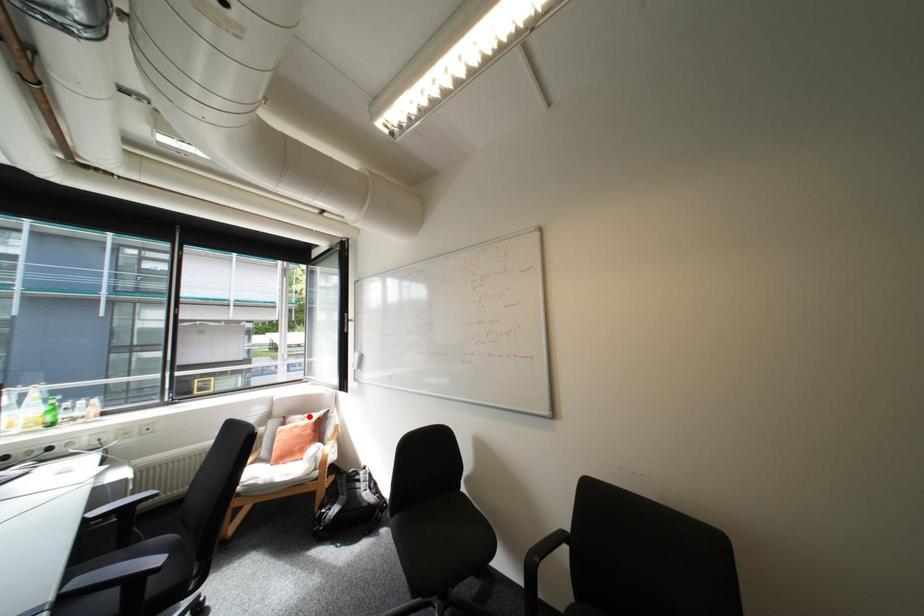
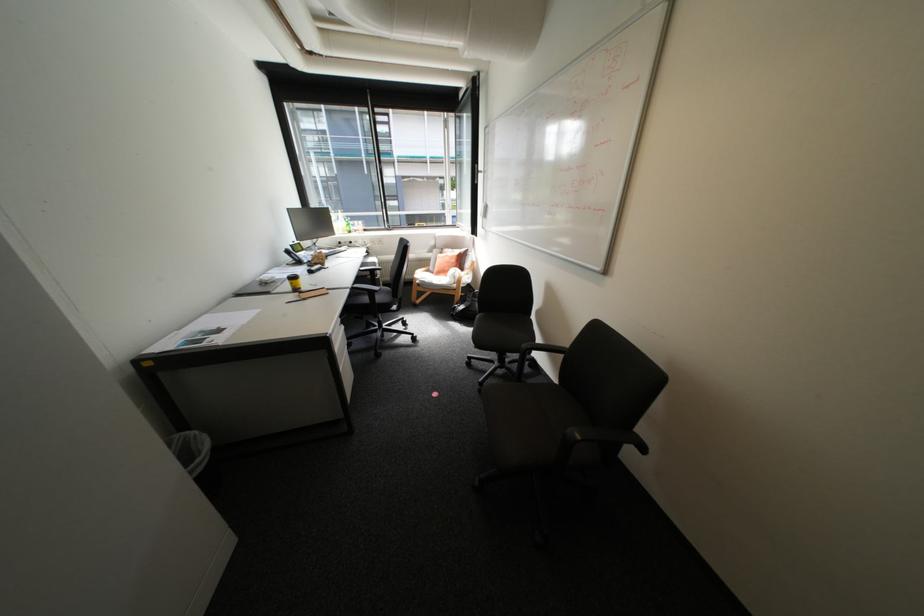
Question: I am providing you with two images of the same scene from different viewpoints. Given a red point in image1, look at the same physical point in image2. Is it:

Choices:
 (A) Closer to the viewpoint
 (B) Farther from the viewpoint

Answer: (A)